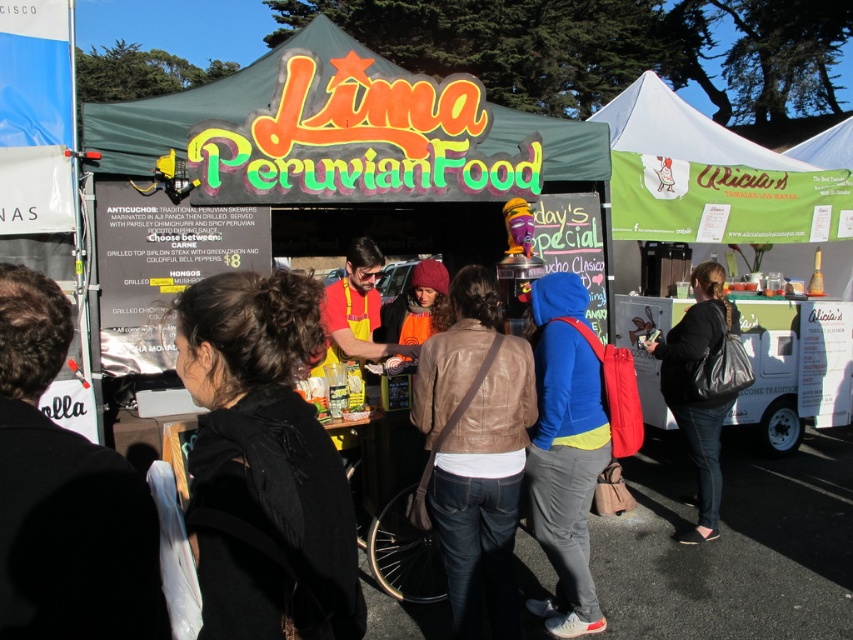
You are a customer at the Lima Peruvian Food stall and you see both the black leather jacket at lower left and the blue fleece jacket at center. Which jacket is covering the other one?

The black leather jacket at lower left is positioned over the blue fleece jacket at center, so it is covering the blue fleece jacket at center.

Looking at this image, you are a customer at the Lima Peruvian Food stall. You want to place your bag on the black fabric at center. Where exactly should you place it?

The black fabric at center is located at coordinates point (264,465), so you should place your bag there.